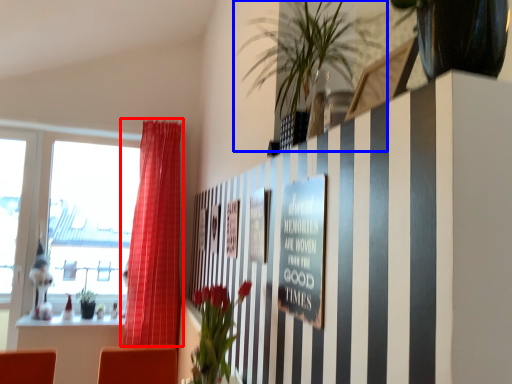
Question: Which of the following is the farthest to the observer, curtain (highlighted by a red box) or houseplant (highlighted by a blue box)?

Choices:
 (A) curtain
 (B) houseplant

Answer: (A)